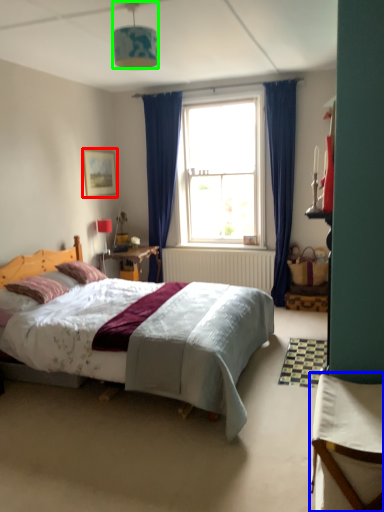
Question: Which object is the closest to the picture frame (highlighted by a red box)? Choose among these: table (highlighted by a blue box) or lamp (highlighted by a green box).

Choices:
 (A) table
 (B) lamp

Answer: (B)